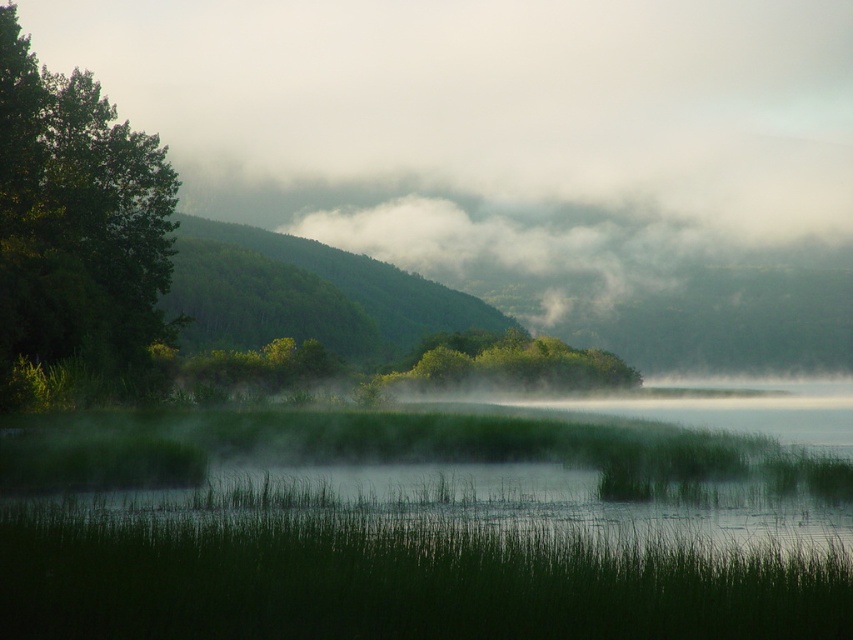
Question: Which object appears farthest from the camera in this image?

Choices:
 (A) green leafy tree at left
 (B) green grassy water at center
 (C) green forested hill at center
 (D) green leafy bush at center

Answer: (C)

Question: Among these objects, which one is nearest to the camera?

Choices:
 (A) green leafy bush at center
 (B) green leafy tree at left
 (C) green grassy water at center
 (D) green forested hill at center

Answer: (C)

Question: Is the position of green leafy tree at left less distant than that of green forested hill at center?

Choices:
 (A) no
 (B) yes

Answer: (B)

Question: Which point is closer to the camera?

Choices:
 (A) green forested hill at center
 (B) green grassy water at center
 (C) green leafy bush at center
 (D) green leafy tree at left

Answer: (B)

Question: Can you confirm if green forested hill at center is bigger than green leafy bush at center?

Choices:
 (A) no
 (B) yes

Answer: (B)

Question: Does green leafy tree at left have a greater width compared to green forested hill at center?

Choices:
 (A) no
 (B) yes

Answer: (A)